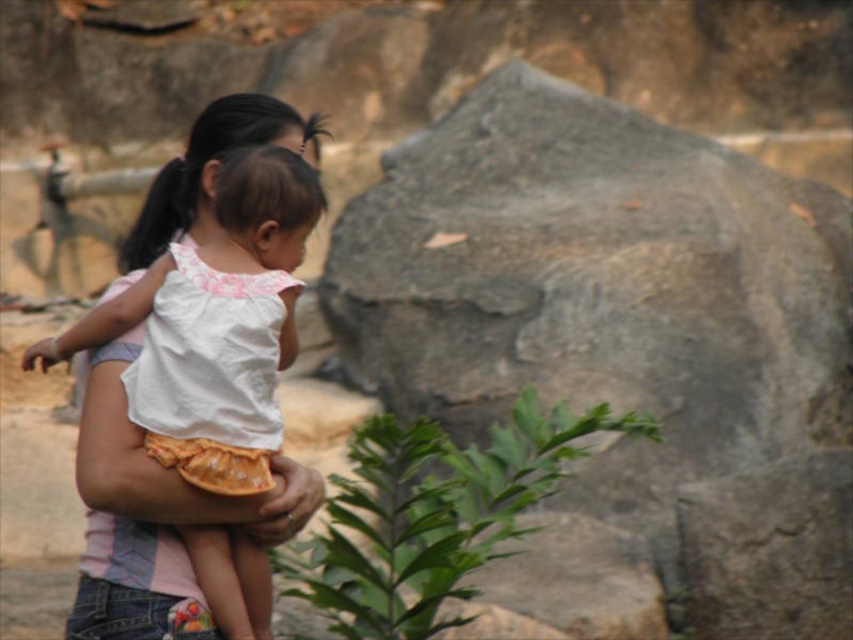
Question: Observing the image, what is the correct spatial positioning of gray rough stone at center in reference to black silky hair at center?

Choices:
 (A) left
 (B) right

Answer: (B)

Question: Does gray rough stone at center have a greater width compared to black silky hair at center?

Choices:
 (A) yes
 (B) no

Answer: (A)

Question: Is green leafy plant at center bigger than white cotton shirt at center?

Choices:
 (A) no
 (B) yes

Answer: (B)

Question: Which of the following is the farthest from the observer?

Choices:
 (A) (136, 243)
 (B) (788, 326)
 (C) (138, 560)

Answer: (B)

Question: Estimate the real-world distances between objects in this image. Which object is farther from the white cotton shirt at center?

Choices:
 (A) black silky hair at center
 (B) gray rough stone at center

Answer: (A)

Question: Which is farther from the white cotton shirt at center?

Choices:
 (A) gray rough stone at center
 (B) green leafy plant at center
 (C) black silky hair at center

Answer: (C)